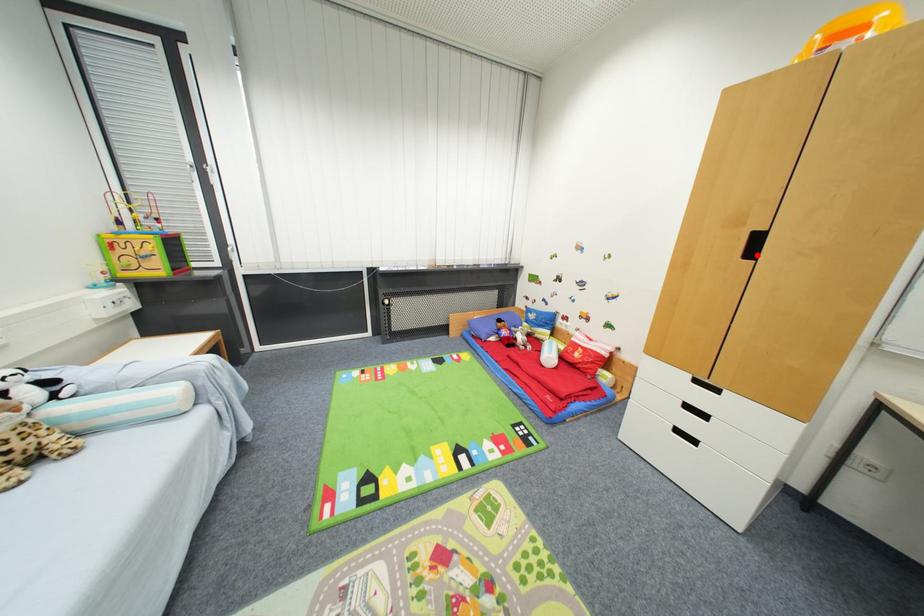
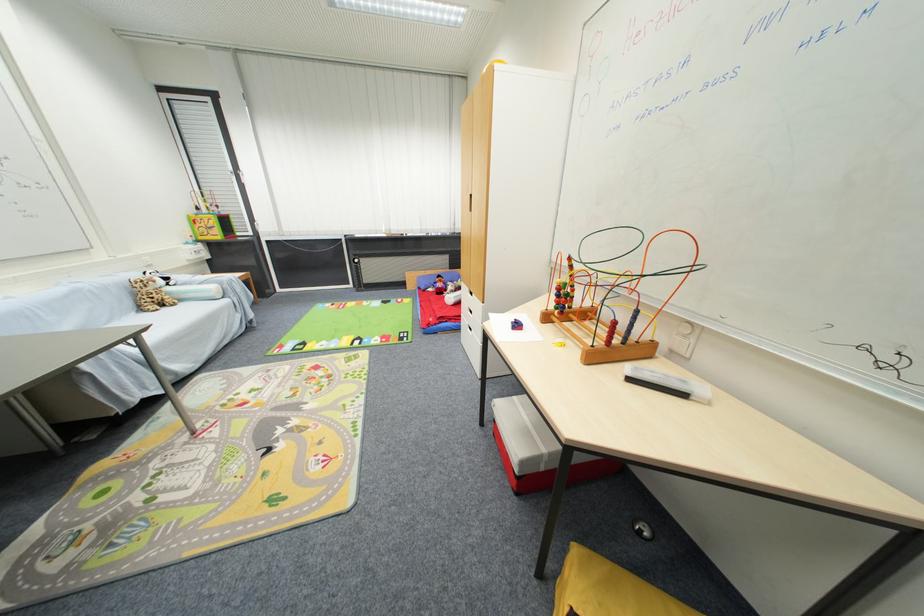
Question: I am providing you with two images of the same scene from different viewpoints. A red point is marked on the first image. At the location where the point appears in image 1, is it still visible in image 2?

Choices:
 (A) Yes
 (B) No

Answer: (B)